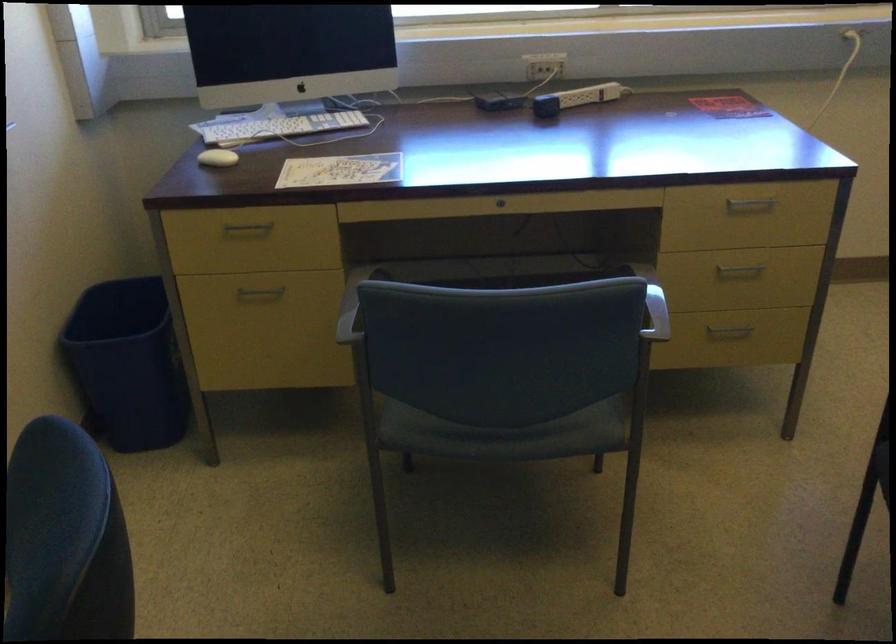
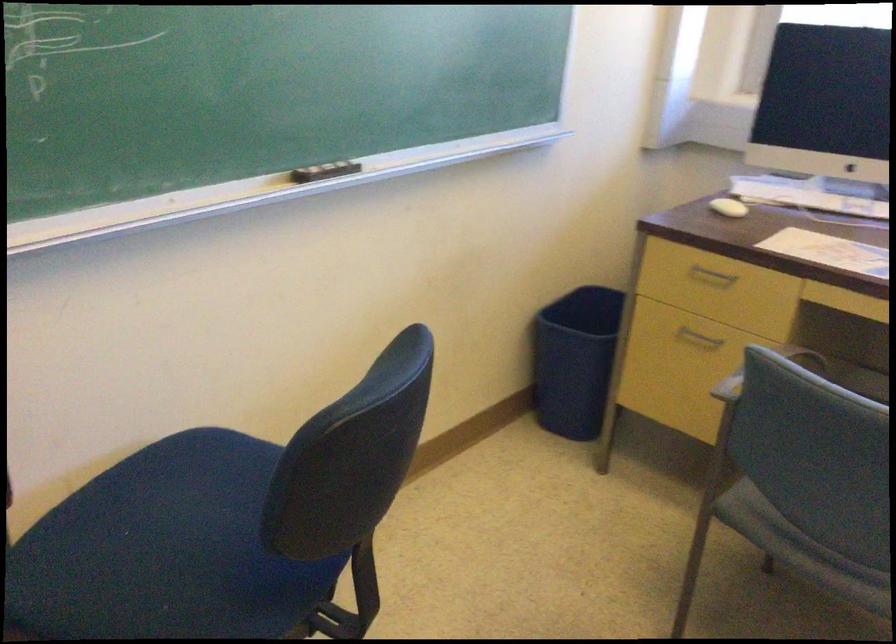
Locate, in the second image, the point that corresponds to the point at 218,164 in the first image.

(728, 207)